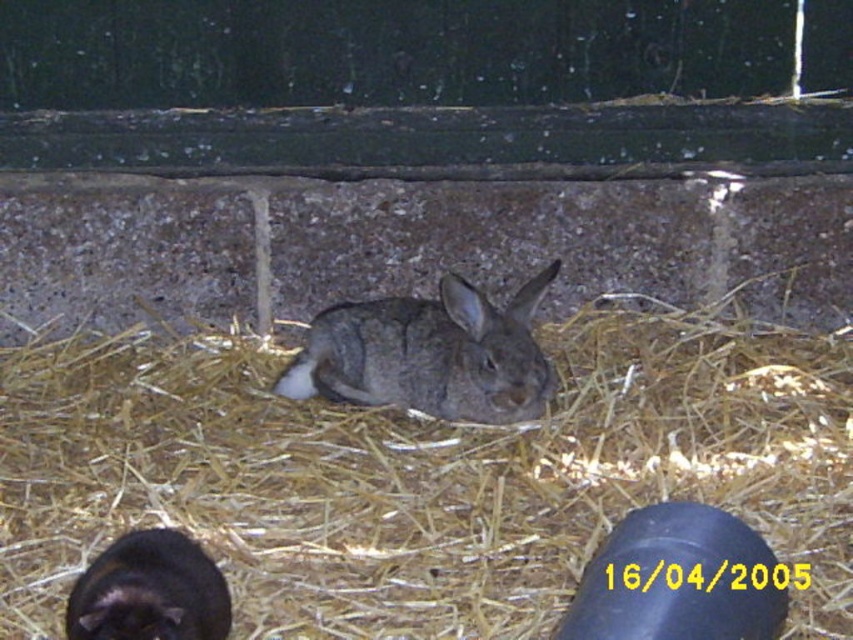
Looking at this image, you are a farmer checking on your animals. You see the brown straw at center and the fuzzy gray rabbit at center in the enclosure. Which object is located more to the left?

The brown straw at center is positioned on the left side of the fuzzy gray rabbit at center, so the brown straw at center is more to the left.

You are a caretaker who needs to place a 30 cm long feeding tray between the brown straw at center and the fuzzy gray rabbit at center. Will there be enough space?

The distance between the brown straw at center and the fuzzy gray rabbit at center is 31.88 centimeters. Since the feeding tray is 30 cm long, there is enough space to place it between them.

You are standing in front of the rabbit pen and want to place a small treat between the two points marked as point (321,618) and point (112,596). Which point should you place the treat closer to so it is in front of both points?

To place the treat in front of both points, you should place it closer to point (112,596) because point (321,618) is behind point (112,596).